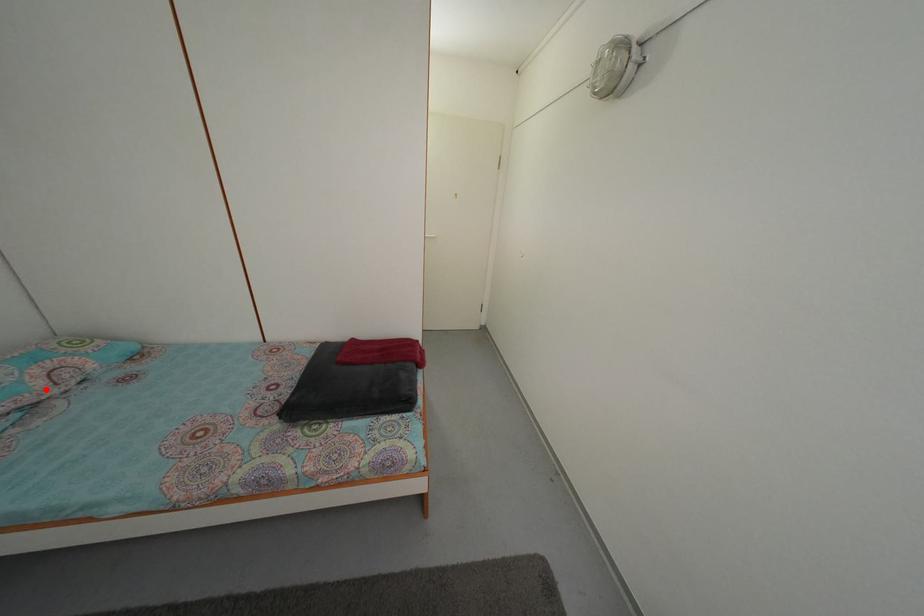
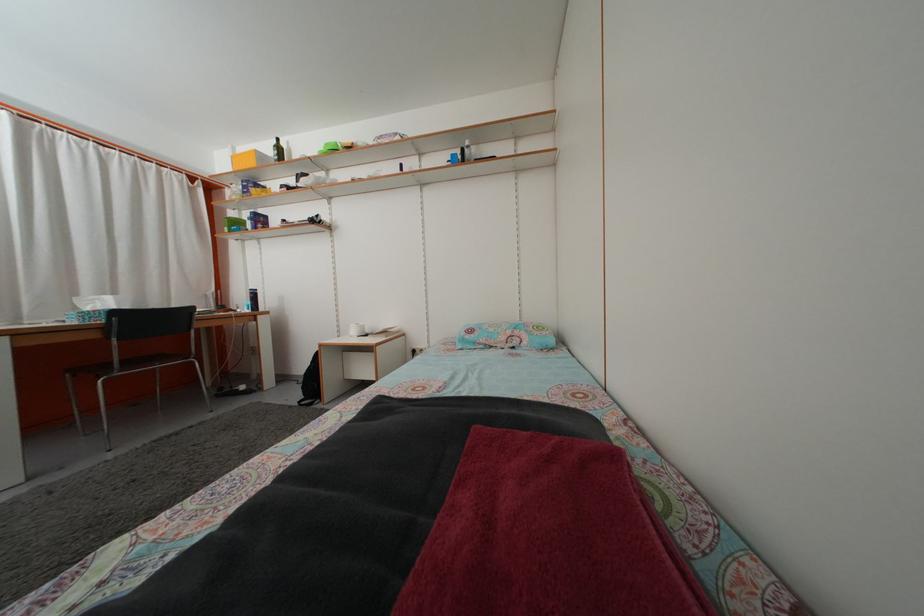
Locate, in the second image, the point that corresponds to the highlighted location in the first image.

(508, 346)